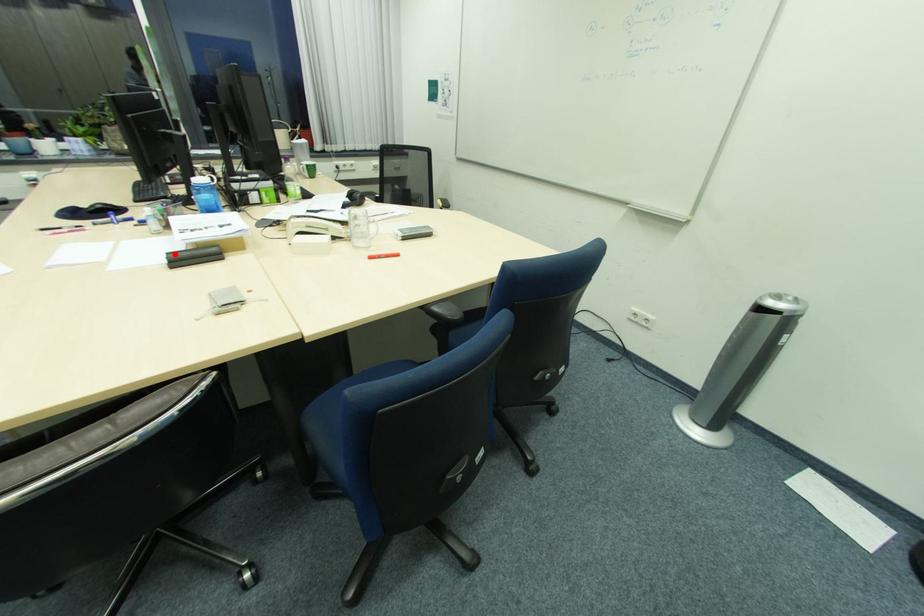
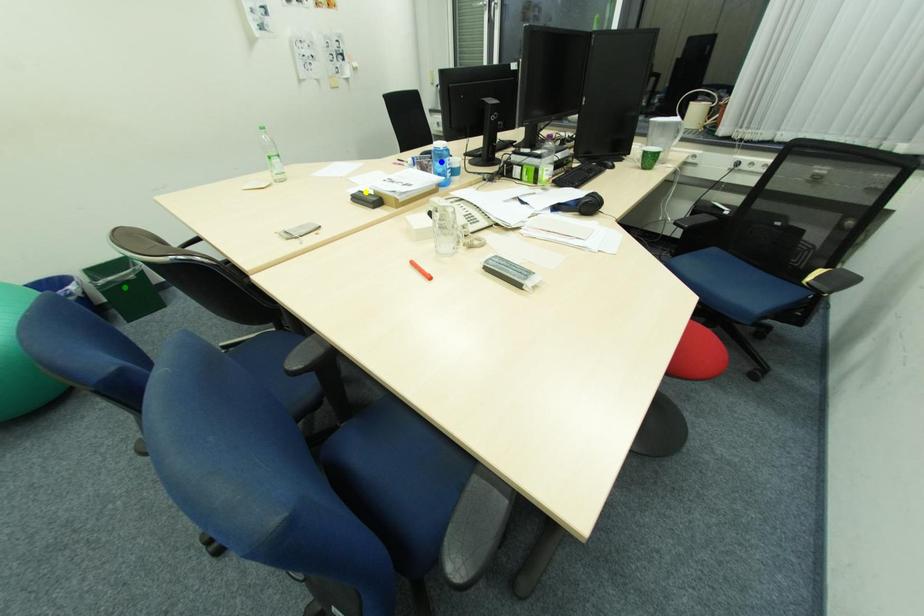
Question: I am providing you with two images of the same scene from different viewpoints. A red point is marked on the first image. You are given multiple points on the second image. Which mark in image 2 goes with the point in image 1?

Choices:
 (A) blue point
 (B) green point
 (C) yellow point

Answer: (C)